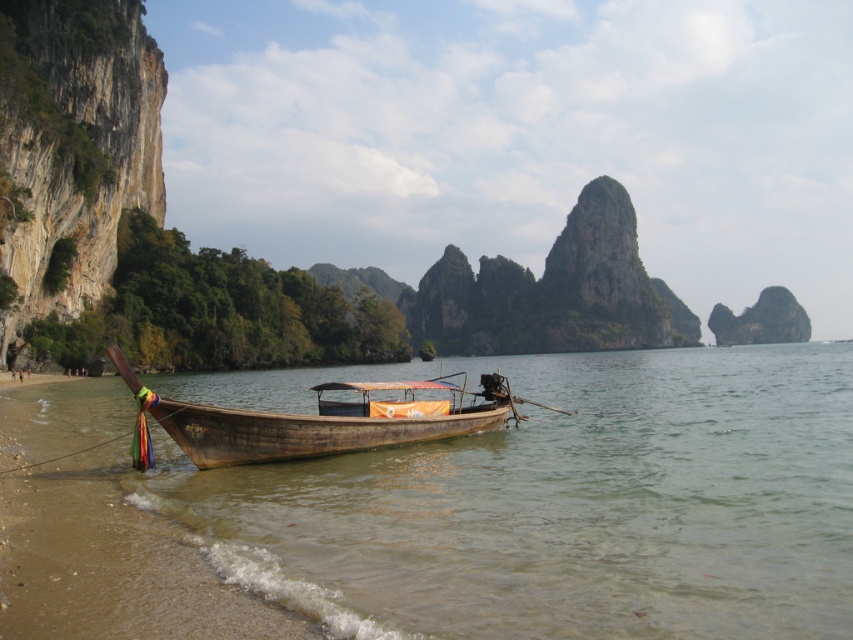
You are a photographer planning to capture the entire scene in one shot. Given that the brown wooden water at lower left and the wooden longboat at center are both in your frame, which object occupies a wider area in the photo?

The brown wooden water at lower left occupies a wider area in the photo since its width is larger than that of the wooden longboat at center.

From the picture: You are standing on the beach looking at the scene. Which object, the brown wooden water at lower left or the wooden longboat at center, is nearer to you?

The brown wooden water at lower left is closer to the viewer than the wooden longboat at center.

You are standing on the sandy beach and see the brown wooden water at lower left and the wooden longboat at center. Which object is taller from your perspective?

The wooden longboat at center is taller than the brown wooden water at lower left.